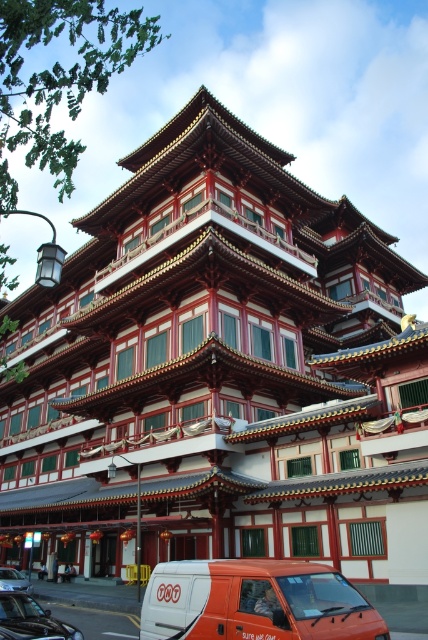
You are standing at the entrance of the traditional Chinese building and want to park your car. You see a shiny black car at lower left and a metallic silver van at lower left. Which vehicle is closer to the building entrance?

The shiny black car at lower left is closer to the building entrance because it is positioned on the right side of the metallic silver van at lower left, implying it is nearer to the entrance.

You are a delivery person who needs to park your metallic silver van at lower left near the traditional Chinese building. The parking spot is to the right of the orange matte van at lower center. Is your van already in the correct parking spot?

The orange matte van at lower center is to the right of the metallic silver van at lower left, so the metallic silver van at lower left is already parked to the left of the orange matte van at lower center. Therefore, it is not in the correct parking spot as the parking spot requires it to be to the right of the orange matte van at lower center.